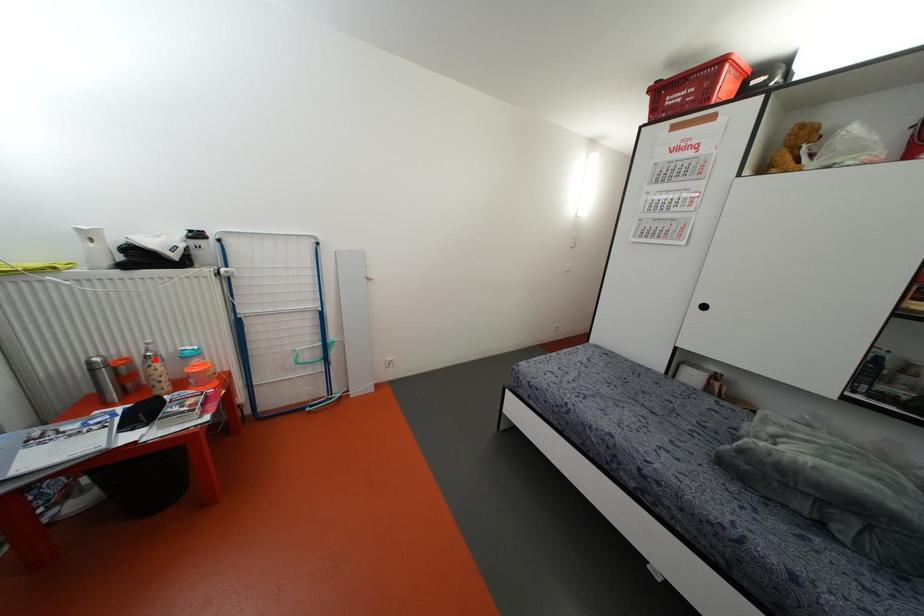
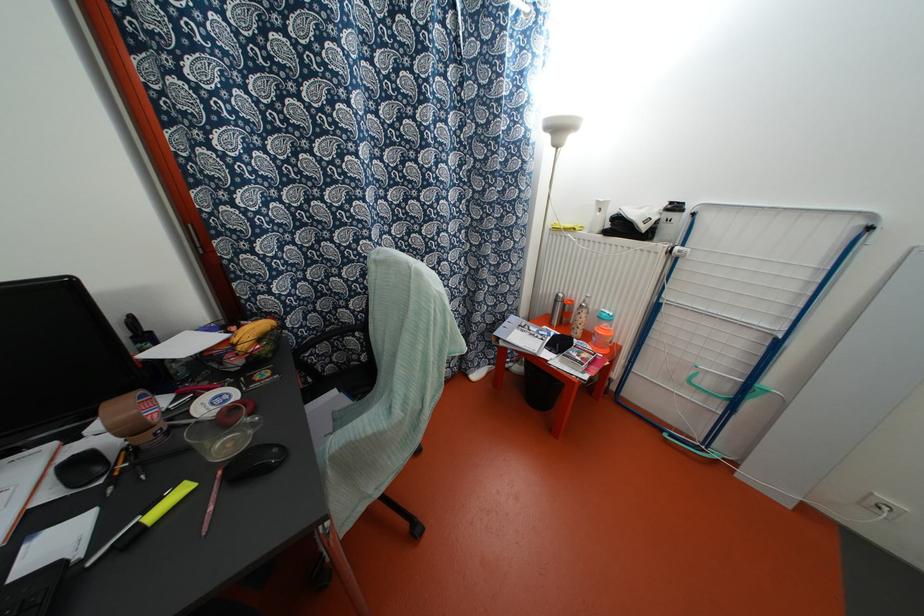
Locate, in the second image, the point that corresponds to the highlighted location in the first image.

(584, 310)